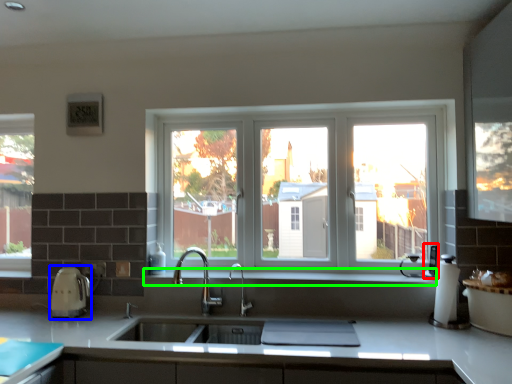
Question: Considering the real-world distances, which object is closest to appliance (highlighted by a red box)? appliance (highlighted by a blue box) or window sill (highlighted by a green box).

Choices:
 (A) appliance
 (B) window sill

Answer: (B)